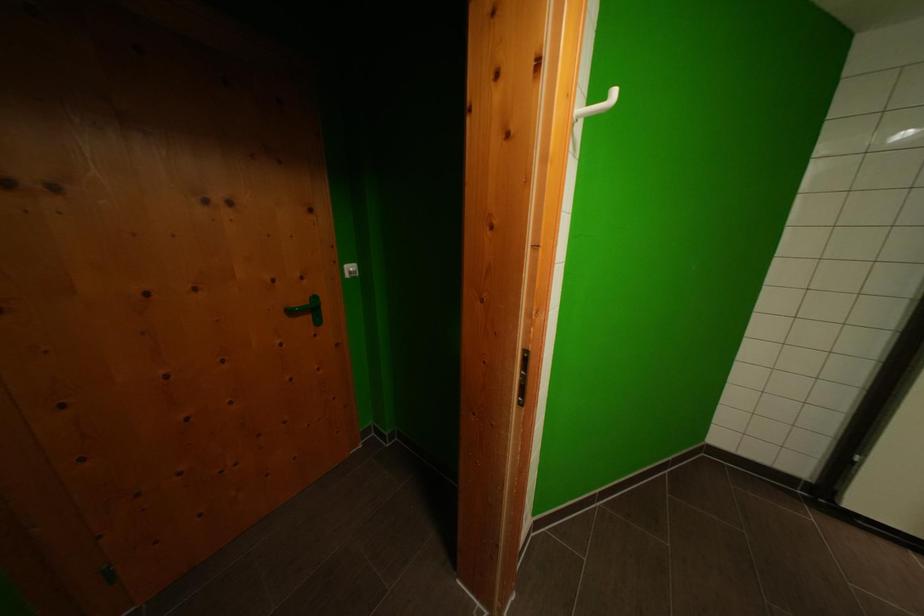
Find where to pull the black door handle. Please return your answer as a coordinate pair (x, y).

(308, 310)